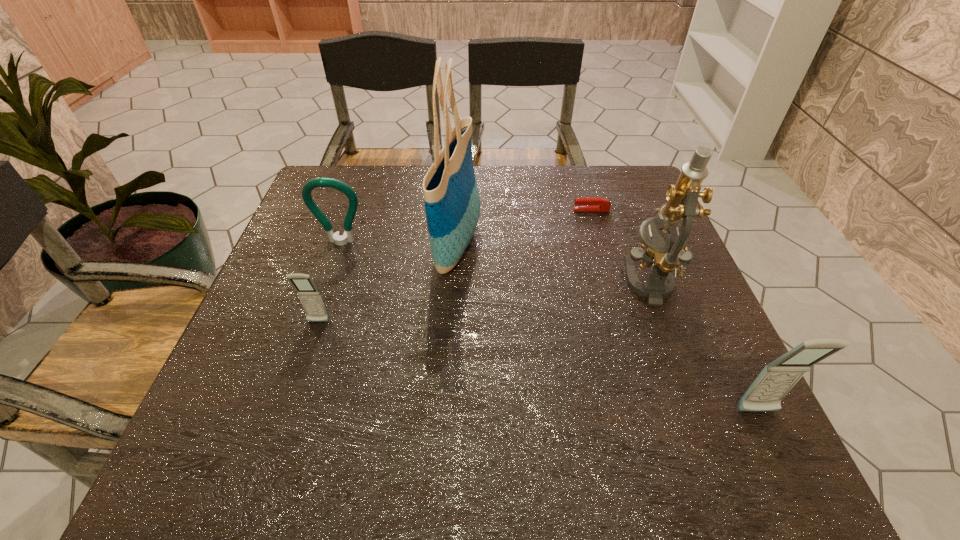
I want to click on free region located on the front-facing side of the shortest object, so click(441, 210).

Find the location of a particular element. vacant area situated on the front-facing side of the shortest object is located at coordinates (459, 210).

You are a GUI agent. You are given a task and a screenshot of the screen. Output one action in this format:
    pyautogui.click(x=<x>, y=<y>)
    Task: Click on the vacant space located 0.230m on the front-facing side of the shortest object
    The width and height of the screenshot is (960, 540).
    Given the screenshot: What is the action you would take?
    pyautogui.click(x=489, y=210)

Locate an element on the screen. Image resolution: width=960 pixels, height=540 pixels. vacant point located at the jaws of the bottle opener is located at coordinates [x=313, y=326].

Where is `blank space located on the front of the tote bag`? blank space located on the front of the tote bag is located at coordinates (450, 379).

Where is `vacant space situated 0.080m on the front of the fifth shortest object`? vacant space situated 0.080m on the front of the fifth shortest object is located at coordinates (676, 339).

Where is `stapler at the far edge`? This screenshot has height=540, width=960. stapler at the far edge is located at coordinates (589, 203).

Identify the location of tote bag at the far edge. (451, 196).

Locate an element on the screen. This screenshot has height=540, width=960. object present at the near edge is located at coordinates (765, 394).

In order to click on cellular telephone located in the left edge section of the desktop in this screenshot , I will do `click(310, 297)`.